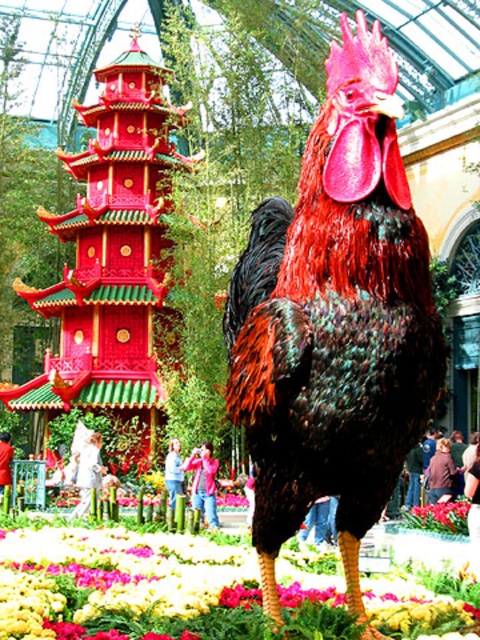
Does shiny red and black feathers at center have a greater height compared to shiny red pagoda at left?

In fact, shiny red and black feathers at center may be shorter than shiny red pagoda at left.

Image resolution: width=480 pixels, height=640 pixels. I want to click on shiny red and black feathers at center, so click(340, 324).

Image resolution: width=480 pixels, height=640 pixels. Find the location of `shiny red and black feathers at center`. shiny red and black feathers at center is located at coordinates (340, 324).

Find the location of a particular element. shiny red and black feathers at center is located at coordinates (340, 324).

In order to click on shiny red and black feathers at center in this screenshot , I will do `click(340, 324)`.

Measure the distance between multicolored fabric at lower center and camera.

multicolored fabric at lower center is 21.05 meters from camera.

Between point (391, 579) and point (434, 513), which one is positioned in front?

Point (391, 579)

In order to click on multicolored fabric at lower center in this screenshot , I will do `click(158, 588)`.

Where is `multicolored fabric at lower center`? Image resolution: width=480 pixels, height=640 pixels. multicolored fabric at lower center is located at coordinates (158, 588).